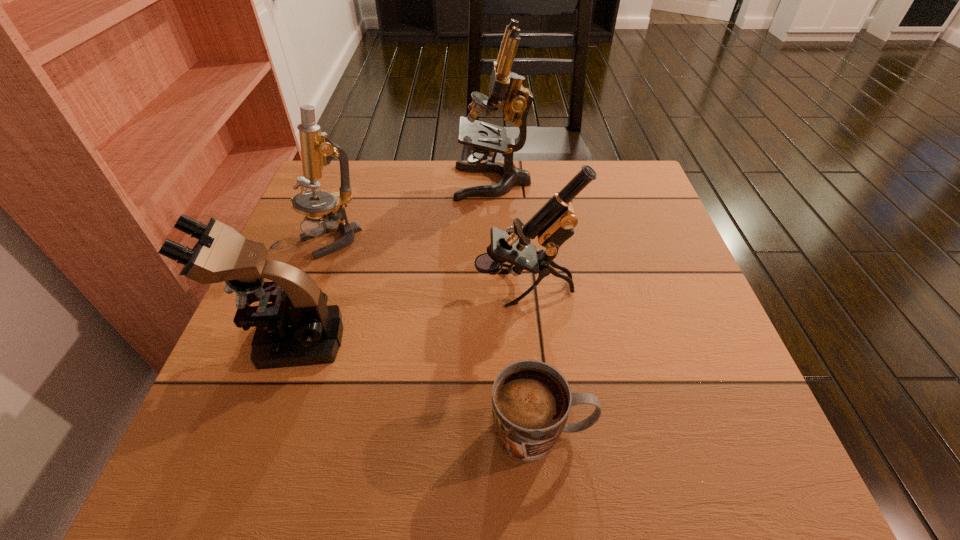
Where is `vacant area between the shortest object and the third nearest microscope`? The height and width of the screenshot is (540, 960). vacant area between the shortest object and the third nearest microscope is located at coordinates (436, 336).

You are a GUI agent. You are given a task and a screenshot of the screen. Output one action in this format:
    pyautogui.click(x=<x>, y=<y>)
    Task: Click on the vacant space that's between the third farthest microscope and the second farthest microscope
    
    Given the screenshot: What is the action you would take?
    pyautogui.click(x=427, y=264)

Identify which object is the fourth closest to the tallest object. Please provide its 2D coordinates. Your answer should be formatted as a tuple, i.e. [(x, y)], where the tuple contains the x and y coordinates of a point satisfying the conditions above.

[(531, 400)]

The width and height of the screenshot is (960, 540). I want to click on the closest object to the second nearest object, so click(317, 150).

Select which microscope appears as the third closest to the shortest object. Please provide its 2D coordinates. Your answer should be formatted as a tuple, i.e. [(x, y)], where the tuple contains the x and y coordinates of a point satisfying the conditions above.

[(317, 150)]

Identify which microscope is the nearest to the third nearest object. Please provide its 2D coordinates. Your answer should be formatted as a tuple, i.e. [(x, y)], where the tuple contains the x and y coordinates of a point satisfying the conditions above.

[(506, 91)]

The width and height of the screenshot is (960, 540). I want to click on free spot that satisfies the following two spatial constraints: 1. at the eyepieces of the tallest microscope; 2. on the front side of the second nearest object, so click(498, 340).

I want to click on free space that satisfies the following two spatial constraints: 1. on the back side of the second farthest object; 2. on the left side of the second nearest object, so [x=326, y=240].